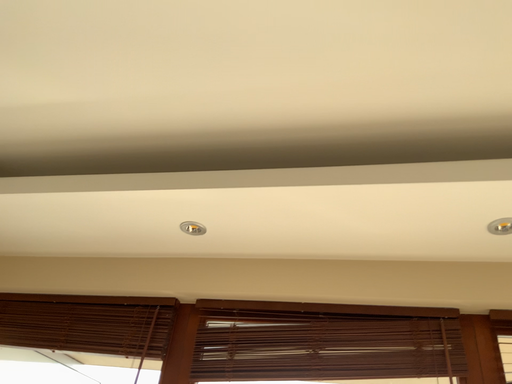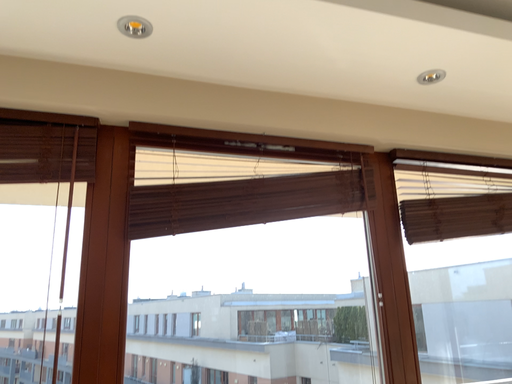
Question: How did the camera likely rotate when shooting the video?

Choices:
 (A) rotated left
 (B) rotated right

Answer: (B)